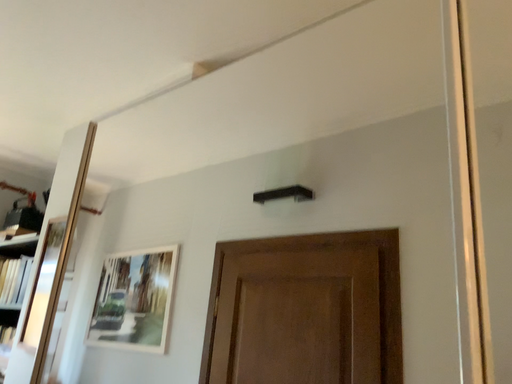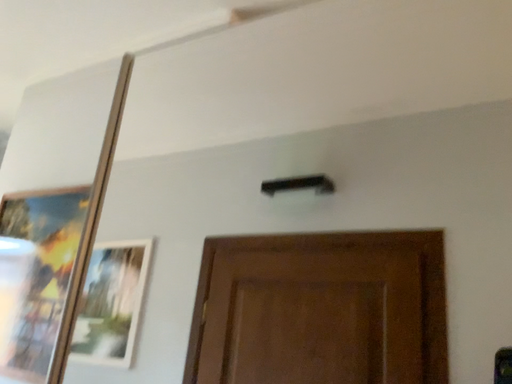
Question: Which way did the camera rotate in the video?

Choices:
 (A) rotated left
 (B) rotated right

Answer: (B)